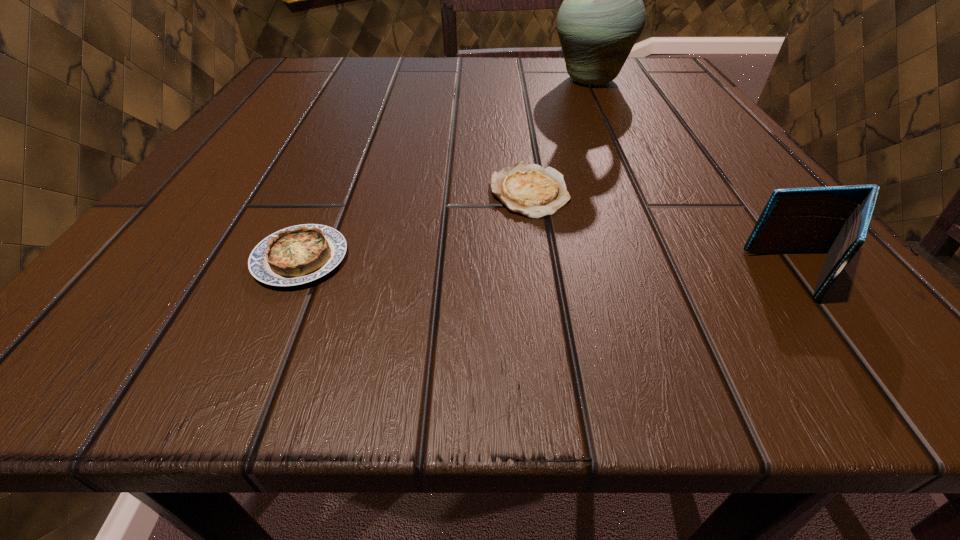
Where is `the tallest object`? This screenshot has height=540, width=960. the tallest object is located at coordinates (602, 16).

The height and width of the screenshot is (540, 960). Identify the location of the farthest object. (602, 16).

Locate an element on the screen. The height and width of the screenshot is (540, 960). the rightmost object is located at coordinates (835, 220).

I want to click on the third shortest object, so click(x=835, y=220).

Image resolution: width=960 pixels, height=540 pixels. What are the coordinates of `the left quiche` in the screenshot? It's located at (300, 254).

In order to click on the third tallest object in this screenshot , I will do `click(300, 254)`.

The image size is (960, 540). I want to click on the right quiche, so click(x=528, y=189).

Locate an element on the screen. the third object from right to left is located at coordinates (528, 189).

What are the coordinates of `vacant area situated on the handle side of the second object from right to left` in the screenshot? It's located at (679, 80).

The height and width of the screenshot is (540, 960). What are the coordinates of `free region located 0.210m on the exterior surface of the wallet` in the screenshot? It's located at (548, 275).